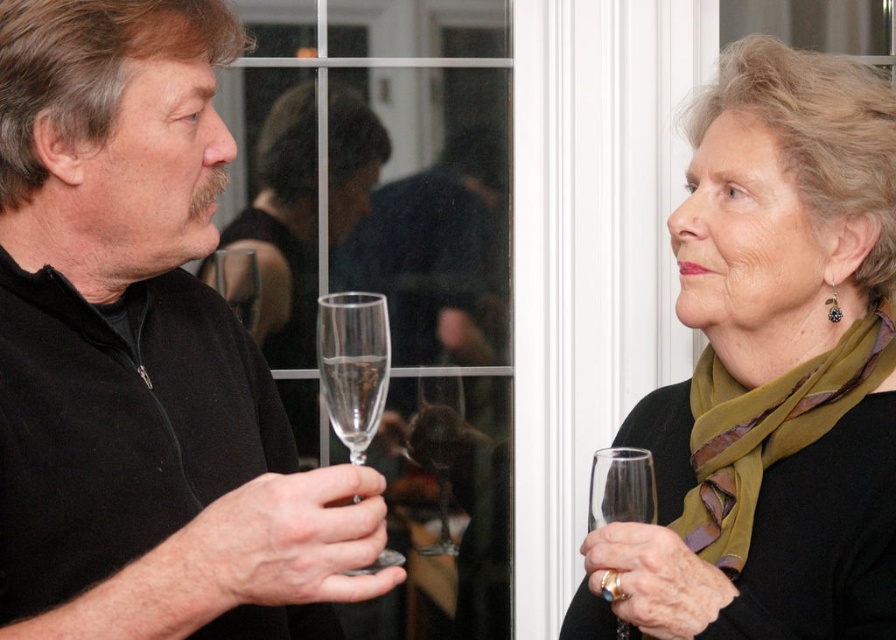
Does clear glass flute at left appear under clear glass wine glass at center?

No, clear glass flute at left is not below clear glass wine glass at center.

What do you see at coordinates (352, 365) in the screenshot? I see `clear glass flute at left` at bounding box center [352, 365].

Between point (350, 349) and point (446, 522), which one is positioned in front?

Point (350, 349)

Where is `clear glass flute at left`? The image size is (896, 640). clear glass flute at left is located at coordinates (352, 365).

Is clear glass wine glass at center taller than clear glass wine glass at right?

Yes, clear glass wine glass at center is taller than clear glass wine glass at right.

Consider the image. Between clear glass wine glass at center and clear glass wine glass at right, which one has more height?

Standing taller between the two is clear glass wine glass at center.

Who is more forward, (448, 404) or (614, 508)?

Point (614, 508) is more forward.

I want to click on clear glass wine glass at center, so click(x=437, y=444).

Does green silk scarf at right have a greater width compared to clear glass wine glass at center?

Indeed, green silk scarf at right has a greater width compared to clear glass wine glass at center.

This screenshot has height=640, width=896. Find the location of `green silk scarf at right`. green silk scarf at right is located at coordinates (768, 429).